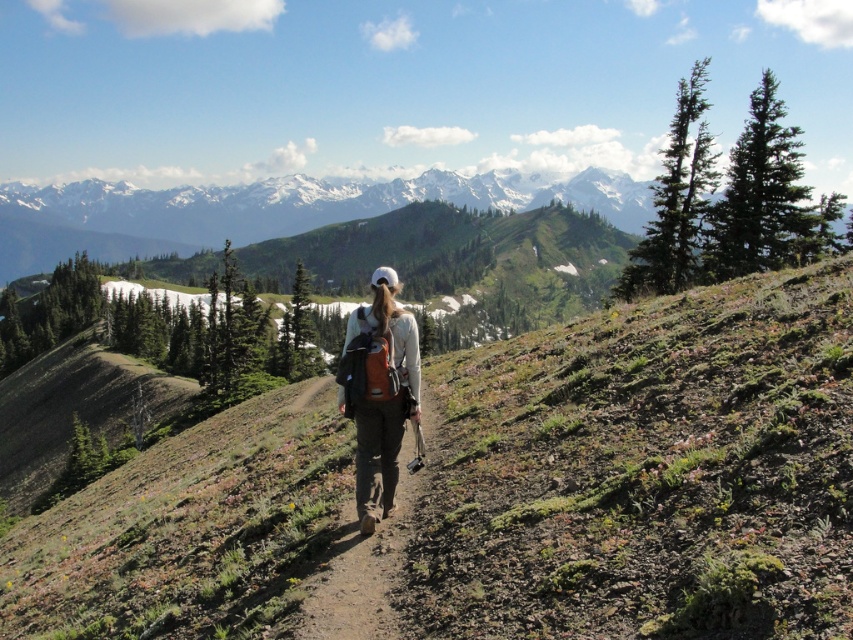
You are a hiker trying to decide which backpack to take for your trip. You see the white matte backpack at center and the brown fabric backpack at center in the image. Which one is positioned to the left?

The white matte backpack at center is positioned to the left of the brown fabric backpack at center.

The hiker is standing at the center of the image. Where is the white matte backpack at center located in relation to the hiker?

The white matte backpack at center is located at the center of the image, so it is directly in front of the hiker.

You are a hiker who wants to know if your white matte backpack at center can fit through a narrow gap in the trail next to the brown fabric backpack at center. Which backpack has a greater width?

The white matte backpack at center might be wider than brown fabric backpack at center, so it may not fit through the narrow gap.